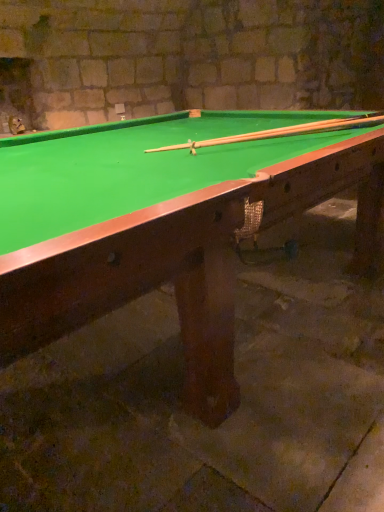
Question: Looking at their shapes, would you say green felt billiard table at center is wider or thinner than wooden cue at center?

Choices:
 (A) thin
 (B) wide

Answer: (B)

Question: Is green felt billiard table at center spatially inside wooden cue at center, or outside of it?

Choices:
 (A) inside
 (B) outside

Answer: (B)

Question: Based on their positions, is green felt billiard table at center located to the left or right of wooden cue at center?

Choices:
 (A) left
 (B) right

Answer: (A)

Question: In the image, is wooden cue at center positioned in front of or behind green felt billiard table at center?

Choices:
 (A) behind
 (B) front

Answer: (A)

Question: Is wooden cue at center bigger or smaller than green felt billiard table at center?

Choices:
 (A) small
 (B) big

Answer: (A)

Question: Considering the positions of wooden cue at center and green felt billiard table at center in the image, is wooden cue at center wider or thinner than green felt billiard table at center?

Choices:
 (A) wide
 (B) thin

Answer: (B)

Question: Is wooden cue at center inside the boundaries of green felt billiard table at center, or outside?

Choices:
 (A) inside
 (B) outside

Answer: (A)